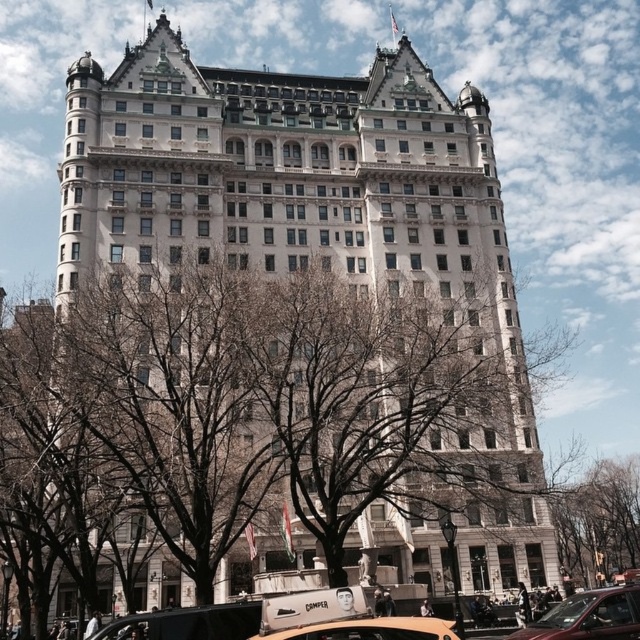
Does bare branches at center have a smaller size compared to metallic red car at lower right?

Incorrect, bare branches at center is not smaller in size than metallic red car at lower right.

Is bare branches at center positioned behind metallic red car at lower right?

Yes.

Is point (608, 497) positioned behind point (624, 616)?

Yes.

Where is `bare branches at center`? The image size is (640, 640). bare branches at center is located at coordinates (595, 515).

Who is more distant from viewer, (605, 472) or (422, 621)?

The point (605, 472) is more distant.

Who is lower down, bare branches at center or metallic gold taxi at lower center?

bare branches at center is lower down.

The height and width of the screenshot is (640, 640). In order to click on bare branches at center in this screenshot , I will do `click(595, 515)`.

Can you confirm if metallic red car at lower right is thinner than metallic gold taxi at lower center?

Yes, metallic red car at lower right is thinner than metallic gold taxi at lower center.

Does metallic red car at lower right have a smaller size compared to metallic gold taxi at lower center?

Yes.

Consider the image. Measure the distance between point (531, 632) and camera.

They are 120.48 feet apart.

The image size is (640, 640). Find the location of `metallic red car at lower right`. metallic red car at lower right is located at coordinates (589, 616).